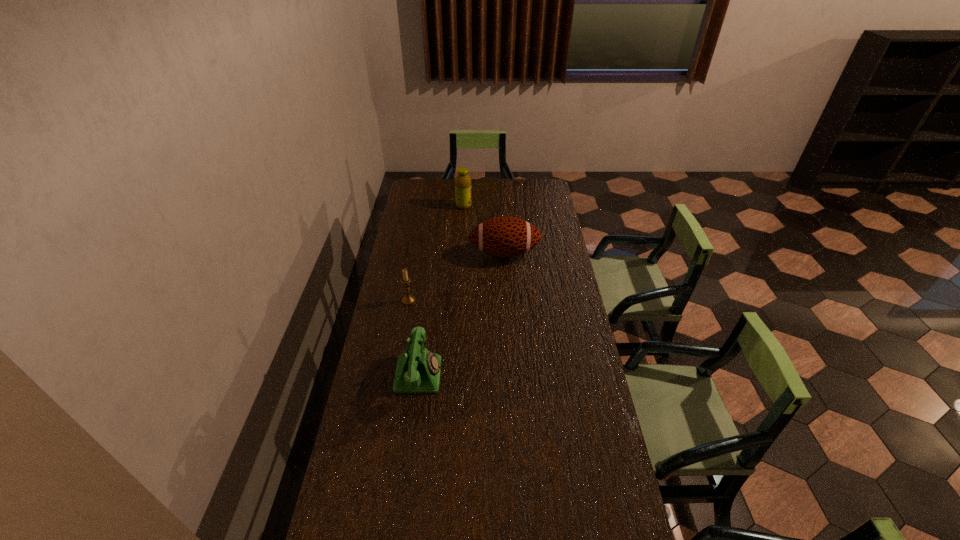
What are the coordinates of `fruit juice` in the screenshot? It's located at (463, 197).

Find the location of a particular element. football is located at coordinates coord(505,236).

Where is `the third farthest object`? the third farthest object is located at coordinates (408, 299).

The image size is (960, 540). Identify the location of the nearest object. click(x=418, y=370).

In order to click on vacant space situated 0.300m on the front label of the farthest object in this screenshot , I will do `click(527, 206)`.

Where is `blank space located 0.270m on the left of the football`? blank space located 0.270m on the left of the football is located at coordinates (412, 253).

Where is `free space located 0.360m on the back of the second nearest object`? The image size is (960, 540). free space located 0.360m on the back of the second nearest object is located at coordinates (419, 244).

The width and height of the screenshot is (960, 540). I want to click on vacant space located on the dial of the telephone, so pos(503,374).

I want to click on candle holder present at the left edge, so click(x=408, y=299).

Where is `telephone located in the left edge section of the desktop`? telephone located in the left edge section of the desktop is located at coordinates (418, 370).